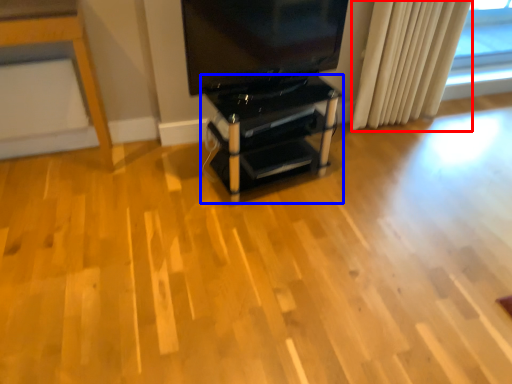
Question: Which point is closer to the camera, curtain (highlighted by a red box) or furniture (highlighted by a blue box)?

Choices:
 (A) curtain
 (B) furniture

Answer: (B)